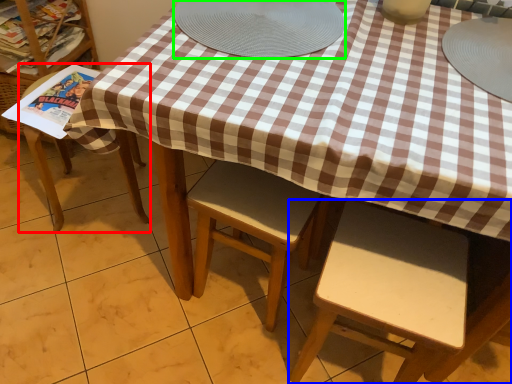
Question: Based on their relative distances, which object is farther from chair (highlighted by a red box)? Choose from chair (highlighted by a blue box) and platter (highlighted by a green box).

Choices:
 (A) chair
 (B) platter

Answer: (A)